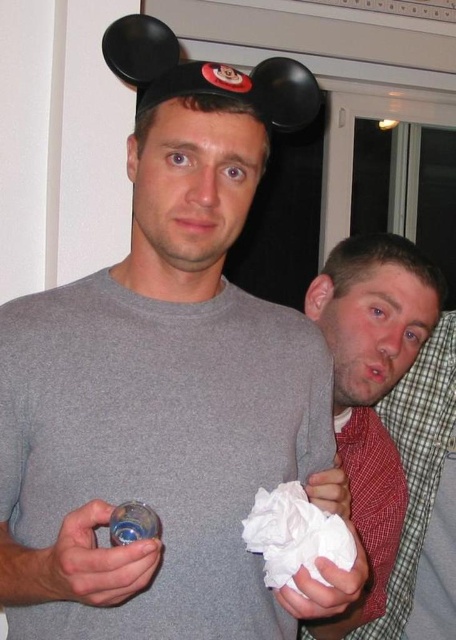
Question: Is red plaid tie at right to the left of white crumpled paper at lower center from the viewer's perspective?

Choices:
 (A) no
 (B) yes

Answer: (A)

Question: Is red plaid tie at right to the left of white crumpled paper at lower center from the viewer's perspective?

Choices:
 (A) no
 (B) yes

Answer: (A)

Question: Does red plaid tie at right have a greater width compared to white crumpled paper at lower center?

Choices:
 (A) no
 (B) yes

Answer: (B)